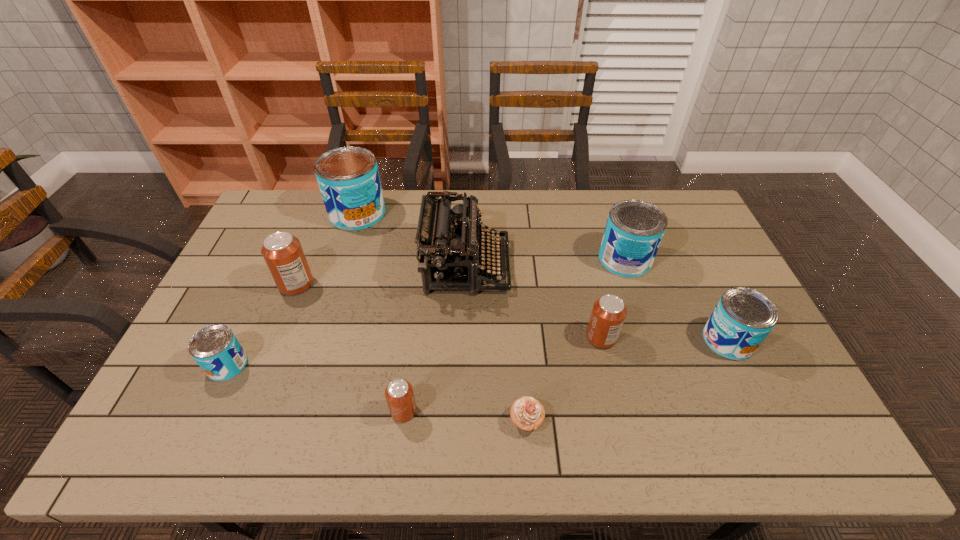
Find the location of a particular element. The image size is (960, 540). free location that satisfies the following two spatial constraints: 1. on the typing side of the cupcake; 2. on the right side of the typewriter is located at coordinates tap(462, 420).

At what (x,y) coordinates should I click in order to perform the action: click on vacant region that satisfies the following two spatial constraints: 1. on the typing side of the fifth can from left to right; 2. on the left side of the typewriter. Please return your answer as a coordinate pair (x, y). This screenshot has width=960, height=540. Looking at the image, I should click on (465, 337).

Locate an element on the screen. The image size is (960, 540). vacant space that satisfies the following two spatial constraints: 1. on the typing side of the typewriter; 2. on the left side of the cupcake is located at coordinates click(462, 420).

Find the location of `free space that satisfies the following two spatial constraints: 1. on the typing side of the cupcake; 2. on the left side of the typewriter`. free space that satisfies the following two spatial constraints: 1. on the typing side of the cupcake; 2. on the left side of the typewriter is located at coordinates (462, 420).

You are a GUI agent. You are given a task and a screenshot of the screen. Output one action in this format:
    pyautogui.click(x=<x>, y=<y>)
    Task: Click on the free space that satisfies the following two spatial constraints: 1. on the typing side of the typewriter; 2. on the back side of the second farthest orange can
    
    Given the screenshot: What is the action you would take?
    pyautogui.click(x=465, y=337)

This screenshot has width=960, height=540. Identify the location of vacant space that satisfies the following two spatial constraints: 1. on the typing side of the typewriter; 2. on the back side of the rightmost object. (465, 340).